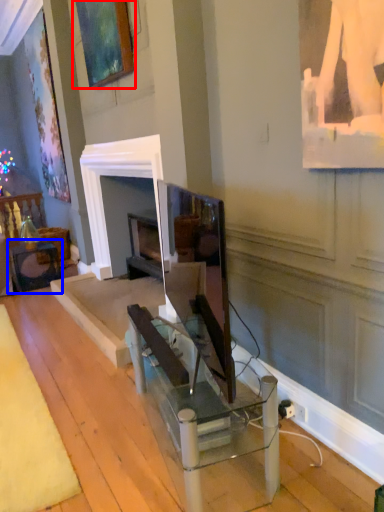
Question: Among these objects, which one is farthest to the camera, picture frame (highlighted by a red box) or table (highlighted by a blue box)?

Choices:
 (A) picture frame
 (B) table

Answer: (B)